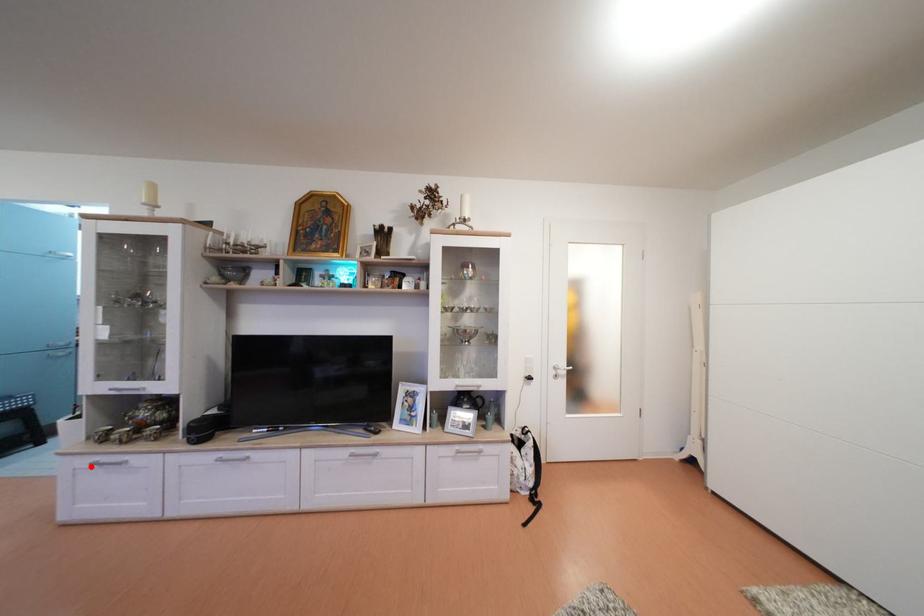
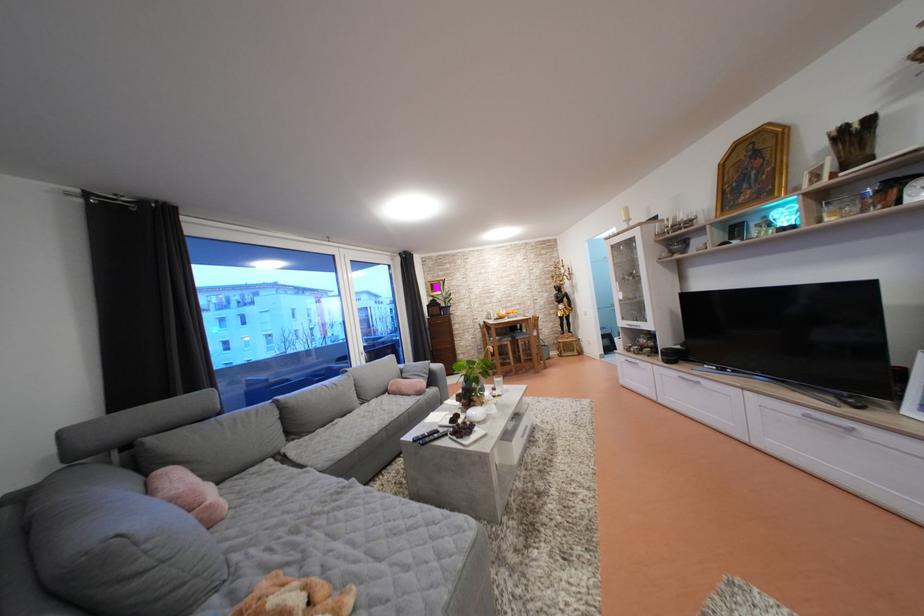
Find the pixel in the second image that matches the highlighted location in the first image.

(630, 363)